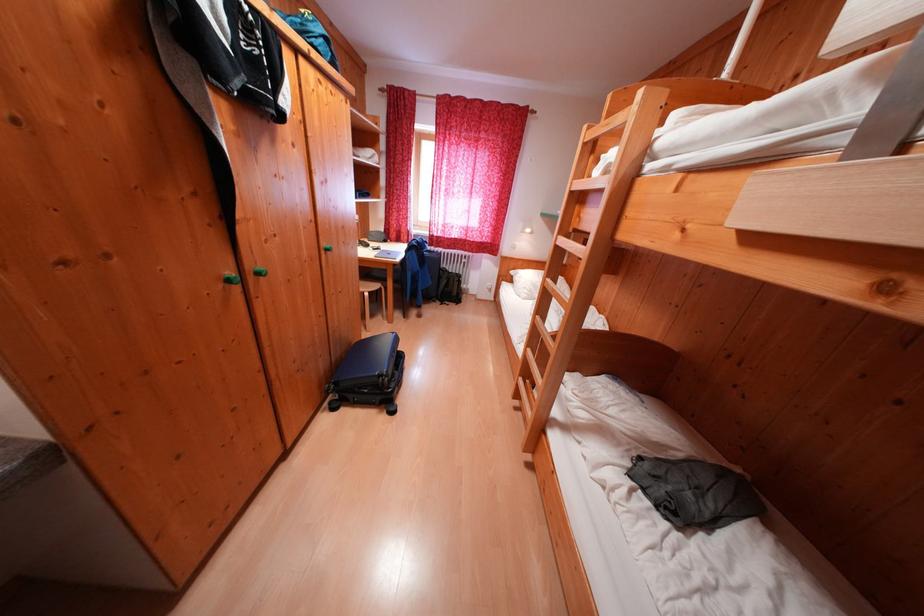
The height and width of the screenshot is (616, 924). Describe the element at coordinates (371, 299) in the screenshot. I see `a chair sitting surface` at that location.